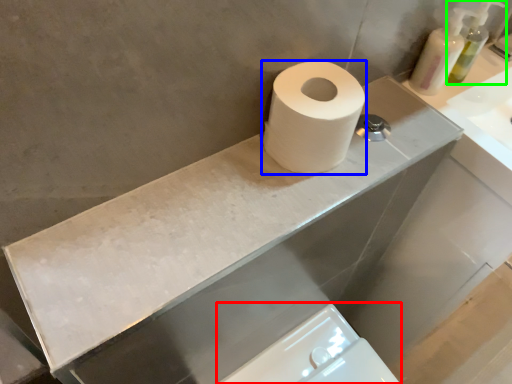
Question: Considering the real-world distances, which object is farthest from bidet (highlighted by a red box)? toilet paper (highlighted by a blue box) or soap dispenser (highlighted by a green box)?

Choices:
 (A) toilet paper
 (B) soap dispenser

Answer: (B)